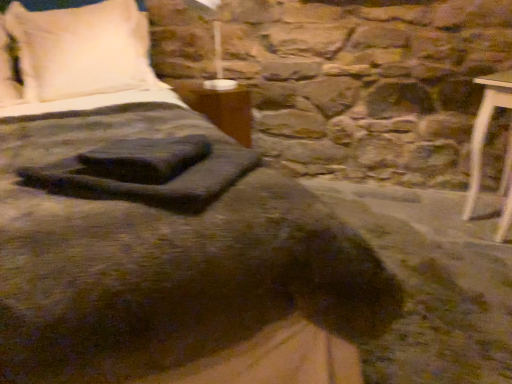
Question: Considering the relative sizes of matte white lampshade at upper center and wooden table at center in the image provided, is matte white lampshade at upper center taller than wooden table at center?

Choices:
 (A) yes
 (B) no

Answer: (A)

Question: Can you confirm if matte white lampshade at upper center is shorter than wooden table at center?

Choices:
 (A) no
 (B) yes

Answer: (A)

Question: Does matte white lampshade at upper center come in front of wooden table at center?

Choices:
 (A) no
 (B) yes

Answer: (B)

Question: Considering the relative sizes of matte white lampshade at upper center and wooden table at center in the image provided, is matte white lampshade at upper center smaller than wooden table at center?

Choices:
 (A) yes
 (B) no

Answer: (B)

Question: Could you tell me if matte white lampshade at upper center is facing wooden table at center?

Choices:
 (A) no
 (B) yes

Answer: (A)

Question: Which is correct: matte white lampshade at upper center is inside white soft pillow at upper left, or outside of it?

Choices:
 (A) outside
 (B) inside

Answer: (A)

Question: From a real-world perspective, is matte white lampshade at upper center physically located above or below white soft pillow at upper left?

Choices:
 (A) below
 (B) above

Answer: (B)

Question: In the image, is matte white lampshade at upper center positioned in front of or behind white soft pillow at upper left?

Choices:
 (A) behind
 (B) front

Answer: (B)

Question: Does point (214, 23) appear closer or farther from the camera than point (111, 82)?

Choices:
 (A) closer
 (B) farther

Answer: (B)

Question: From the image's perspective, is white soft pillow at upper left positioned above or below wooden table at center?

Choices:
 (A) above
 (B) below

Answer: (A)

Question: Is white soft pillow at upper left situated inside wooden table at center or outside?

Choices:
 (A) outside
 (B) inside

Answer: (A)

Question: Based on their positions, is white soft pillow at upper left located to the left or right of wooden table at center?

Choices:
 (A) left
 (B) right

Answer: (A)

Question: Is white soft pillow at upper left bigger or smaller than wooden table at center?

Choices:
 (A) big
 (B) small

Answer: (A)

Question: Is wooden table at center spatially inside matte white lampshade at upper center, or outside of it?

Choices:
 (A) inside
 (B) outside

Answer: (B)

Question: From the image's perspective, is wooden table at center positioned above or below matte white lampshade at upper center?

Choices:
 (A) below
 (B) above

Answer: (A)